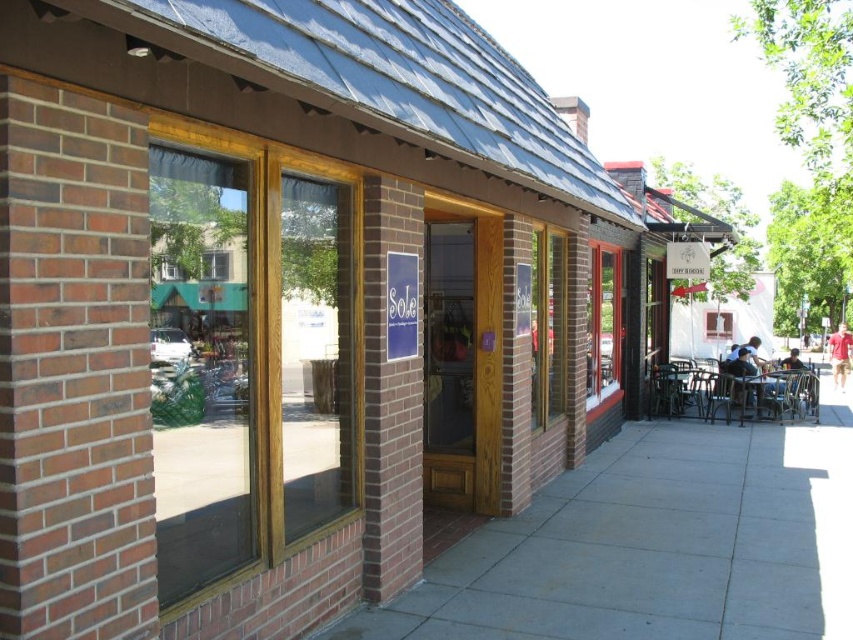
You are a delivery person standing on the gray concrete sidewalk at center. You need to hand over a package to the store clerk through the clear glass window at center. Can you reach the window from your current position on the sidewalk?

The clear glass window at center is located above gray concrete sidewalk at center, so you can reach the window from the sidewalk by extending your arm upwards.

You are standing in front of the storefront and want to place a small decoration between the two points, point (157,355) and point (538,516). Which point should the decoration be closer to in order to appear larger to someone looking at the storefront from the sidewalk?

The decoration should be placed closer to point (157,355) because it is closer to the viewer, making objects placed there appear larger than those further away like point (538,516).

Based on the photo, you are a delivery person trying to park your cart near the store entrance. The cart requires a flat surface. Based on the image, can you park the cart on the gray concrete sidewalk at center without it being blocked by the metallic silver table at lower right?

The gray concrete sidewalk at center is positioned under the metallic silver table at lower right, so the table is likely blocking the sidewalk. Therefore, you cannot park the cart there without obstruction.